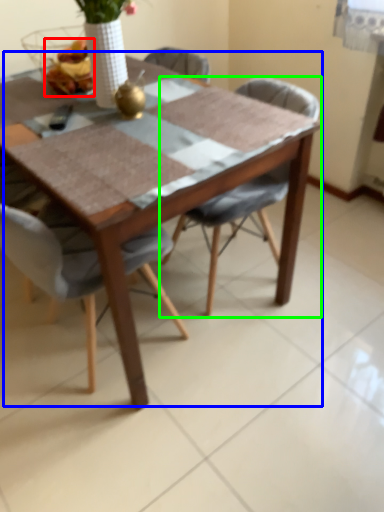
Question: Based on their relative distances, which object is nearer to food (highlighted by a red box)? Choose from table (highlighted by a blue box) and chair (highlighted by a green box).

Choices:
 (A) table
 (B) chair

Answer: (A)